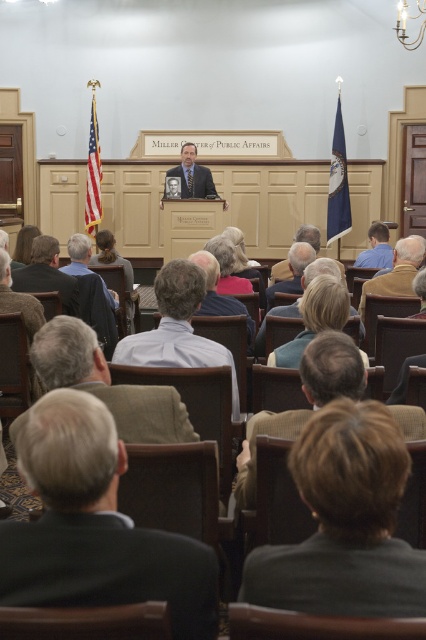
You are standing at the back of the conference room and want to walk to the podium. There are two points marked on the floor. One is at coordinate point (181, 337) and the other is at coordinate point (388, 260). Which point should you pass through to reach the podium more quickly?

You should pass through point (181, 337) to reach the podium more quickly because it is in front of point (388, 260).

What is the exact coordinate of the light blue shirt at center?

The light blue shirt at center is located at coordinate point (178,328).